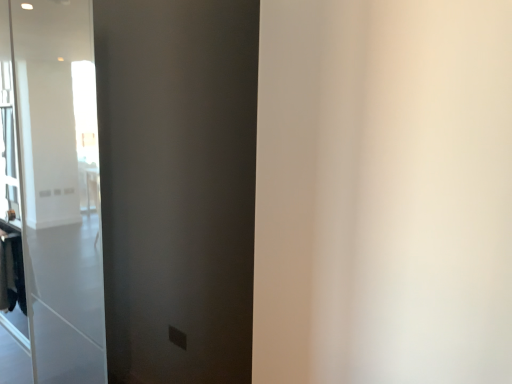
In order to face dark brown fabric laundry at lower left, should I rotate leftwards or rightwards?

Rotate your view left by about 30.927°.

What is the approximate width of dark brown fabric laundry at lower left?

dark brown fabric laundry at lower left is 3.18 inches in width.

Locate an element on the screen. The image size is (512, 384). dark brown fabric laundry at lower left is located at coordinates (12, 272).

Image resolution: width=512 pixels, height=384 pixels. Describe the element at coordinates (12, 272) in the screenshot. I see `dark brown fabric laundry at lower left` at that location.

Measure the distance between dark brown fabric laundry at lower left and camera.

The distance of dark brown fabric laundry at lower left from camera is 1.71 meters.

What do you see at coordinates (177, 187) in the screenshot? The width and height of the screenshot is (512, 384). I see `matte black barn door at center` at bounding box center [177, 187].

Where is `matte black barn door at center`? The width and height of the screenshot is (512, 384). matte black barn door at center is located at coordinates (177, 187).

You are a GUI agent. You are given a task and a screenshot of the screen. Output one action in this format:
    pyautogui.click(x=<x>, y=<y>)
    Task: Click on the dark brown fabric laundry at lower left
    This screenshot has height=384, width=512.
    Given the screenshot: What is the action you would take?
    pyautogui.click(x=12, y=272)

Is dark brown fabric laundry at lower left at the right side of matte black barn door at center?

No, dark brown fabric laundry at lower left is not to the right of matte black barn door at center.

Is the position of dark brown fabric laundry at lower left less distant than that of matte black barn door at center?

No, the depth of dark brown fabric laundry at lower left is greater than that of matte black barn door at center.

Does point (14, 291) come closer to viewer compared to point (248, 28)?

No.

From the image's perspective, is dark brown fabric laundry at lower left under matte black barn door at center?

Yes.

From a real-world perspective, is dark brown fabric laundry at lower left under matte black barn door at center?

Yes, from a real-world perspective, dark brown fabric laundry at lower left is under matte black barn door at center.

Is dark brown fabric laundry at lower left wider or thinner than matte black barn door at center?

In the image, dark brown fabric laundry at lower left appears to be more narrow than matte black barn door at center.

Is dark brown fabric laundry at lower left shorter than matte black barn door at center?

Yes.

Who is smaller, dark brown fabric laundry at lower left or matte black barn door at center?

dark brown fabric laundry at lower left is smaller.

Do you think dark brown fabric laundry at lower left is within matte black barn door at center, or outside of it?

dark brown fabric laundry at lower left is not inside matte black barn door at center, it's outside.

Would you say dark brown fabric laundry at lower left is a long distance from matte black barn door at center?

dark brown fabric laundry at lower left is actually quite close to matte black barn door at center.

Looking at this image, is dark brown fabric laundry at lower left aimed at matte black barn door at center?

No.

At what (x,y) coordinates should I click in order to perform the action: click on barn door above the dark brown fabric laundry at lower left (from the image's perspective). Please return your answer as a coordinate pair (x, y). This screenshot has height=384, width=512. Looking at the image, I should click on (177, 187).

Based on the photo, is matte black barn door at center to the right of dark brown fabric laundry at lower left from the viewer's perspective?

Yes.

Relative to dark brown fabric laundry at lower left, is matte black barn door at center in front or behind?

Visually, matte black barn door at center is located in front of dark brown fabric laundry at lower left.

Is point (187, 238) behind point (13, 309)?

No.

From the image's perspective, relative to dark brown fabric laundry at lower left, is matte black barn door at center above or below?

matte black barn door at center is situated higher than dark brown fabric laundry at lower left in the image.

From a real-world perspective, is matte black barn door at center under dark brown fabric laundry at lower left?

No, from a real-world perspective, matte black barn door at center is not beneath dark brown fabric laundry at lower left.

Which object is wider, matte black barn door at center or dark brown fabric laundry at lower left?

matte black barn door at center is wider.

Between matte black barn door at center and dark brown fabric laundry at lower left, which one has less height?

dark brown fabric laundry at lower left.

Who is bigger, matte black barn door at center or dark brown fabric laundry at lower left?

With larger size is matte black barn door at center.

Is matte black barn door at center positioned beyond the bounds of dark brown fabric laundry at lower left?

Yes, matte black barn door at center is not within dark brown fabric laundry at lower left.

Is matte black barn door at center not near dark brown fabric laundry at lower left?

No, matte black barn door at center is in close proximity to dark brown fabric laundry at lower left.

Is matte black barn door at center looking in the opposite direction of dark brown fabric laundry at lower left?

matte black barn door at center is not turned away from dark brown fabric laundry at lower left.

What's the angular difference between matte black barn door at center and dark brown fabric laundry at lower left's facing directions?

They differ by 1.03 degrees in their facing directions.

The width and height of the screenshot is (512, 384). In order to click on laundry that is below the matte black barn door at center (from the image's perspective) in this screenshot , I will do `click(12, 272)`.

This screenshot has height=384, width=512. I want to click on barn door in front of the dark brown fabric laundry at lower left, so click(177, 187).

The image size is (512, 384). I want to click on barn door above the dark brown fabric laundry at lower left (from the image's perspective), so click(177, 187).